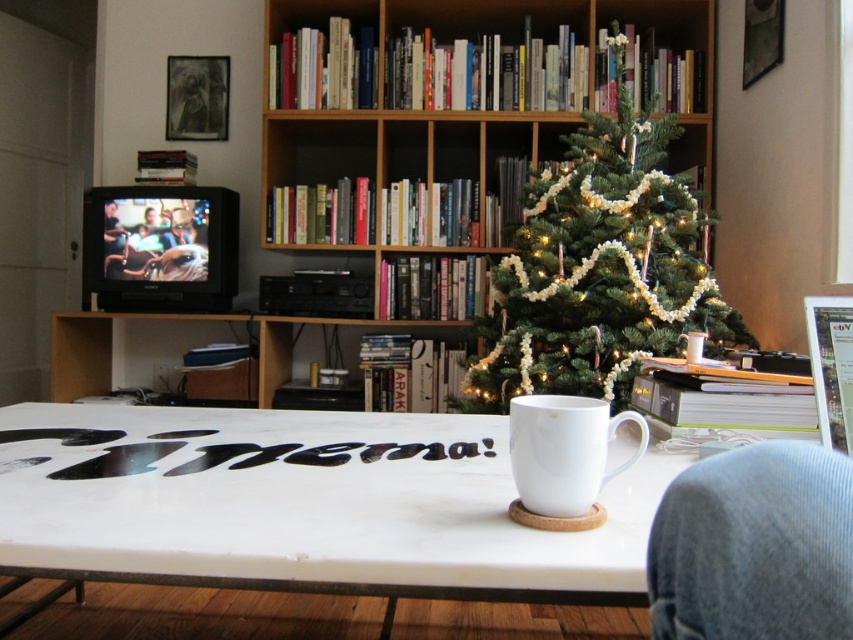
You are sitting at the white ceramic mug at center and want to reach the green textured christmas tree at center. Which direction should you move to get closer to the tree?

Since the white ceramic mug at center is behind the green textured christmas tree at center, you should move forward to get closer to the tree.

You are standing in the living room and want to place a new book on the bookshelf near the green textured christmas tree at center. Based on the coordinates provided, where should you place the book relative to the tree?

The green textured christmas tree at center is located at coordinates point [601,268], so you should place the new book on the bookshelf near the green textured christmas tree at center at those coordinates.